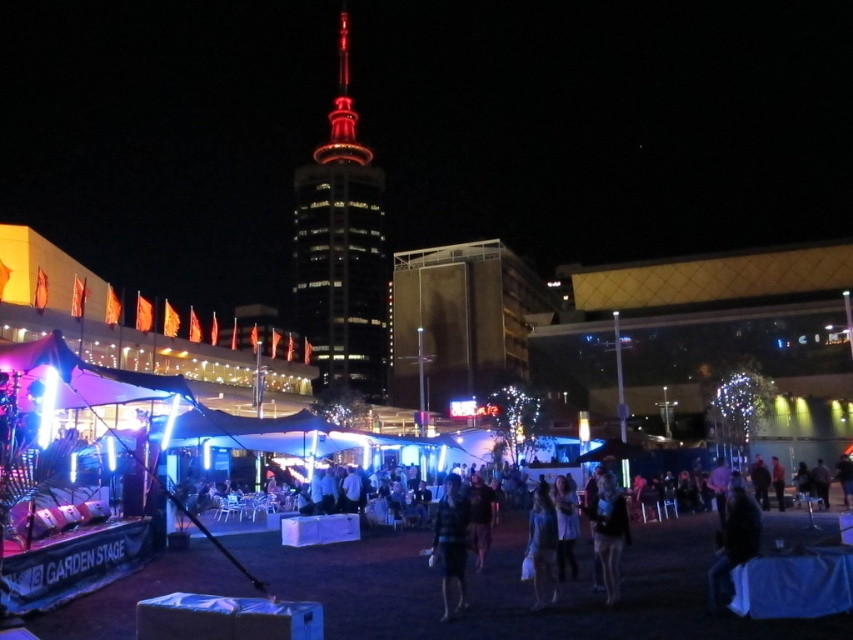
Question: Among these points, which one is nearest to the camera?

Choices:
 (A) (619, 518)
 (B) (445, 547)

Answer: (B)

Question: Which point appears farthest from the camera in this image?

Choices:
 (A) (601, 532)
 (B) (310, 234)

Answer: (B)

Question: Which point is closer to the camera?

Choices:
 (A) (461, 596)
 (B) (366, 164)
 (C) (618, 550)

Answer: (A)

Question: Where is striped fabric shirt at center located in relation to dark blue fabric at center in the image?

Choices:
 (A) left
 (B) right

Answer: (A)

Question: Does shiny glass tower at center appear over dark blue fabric at center?

Choices:
 (A) no
 (B) yes

Answer: (B)

Question: Considering the relative positions of shiny glass tower at center and striped fabric shirt at center in the image provided, where is shiny glass tower at center located with respect to striped fabric shirt at center?

Choices:
 (A) above
 (B) below

Answer: (A)